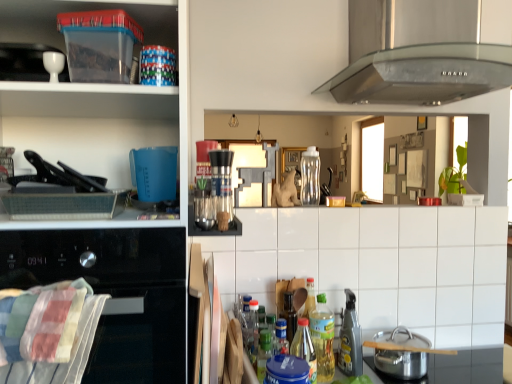
Question: Considering the relative positions of black glass oven at left, the first home appliance from the bottom, and plaid fabric towel at lower left in the image provided, is black glass oven at left, the first home appliance from the bottom, to the left of plaid fabric towel at lower left from the viewer's perspective?

Choices:
 (A) yes
 (B) no

Answer: (A)

Question: From a real-world perspective, is black glass oven at left, the first home appliance from the bottom, located higher than plaid fabric towel at lower left?

Choices:
 (A) yes
 (B) no

Answer: (B)

Question: From the image's perspective, does black glass oven at left, the first home appliance from the bottom, appear higher than plaid fabric towel at lower left?

Choices:
 (A) no
 (B) yes

Answer: (A)

Question: Is black glass oven at left, the 2th home appliance positioned from the right, oriented towards plaid fabric towel at lower left?

Choices:
 (A) no
 (B) yes

Answer: (B)

Question: Is black glass oven at left, the 2th home appliance positioned from the right, wider than plaid fabric towel at lower left?

Choices:
 (A) yes
 (B) no

Answer: (A)

Question: From a real-world perspective, does black glass oven at left, the 2th home appliance positioned from the right, sit lower than plaid fabric towel at lower left?

Choices:
 (A) yes
 (B) no

Answer: (A)

Question: Are transparent plastic container at upper left, which appears as the third shelf when viewed from the right, and translucent plastic bottle at center, which is the 3th bottle in back-to-front order, located far from each other?

Choices:
 (A) no
 (B) yes

Answer: (A)

Question: Is transparent plastic container at upper left, which ranks as the first shelf in left-to-right order, next to translucent plastic bottle at center, which is the 3th bottle in back-to-front order?

Choices:
 (A) yes
 (B) no

Answer: (B)

Question: Is transparent plastic container at upper left, which appears as the third shelf when viewed from the right, closer to camera compared to translucent plastic bottle at center, which is the 3th bottle in back-to-front order?

Choices:
 (A) no
 (B) yes

Answer: (B)

Question: From the image's perspective, is transparent plastic container at upper left, which ranks as the first shelf in left-to-right order, on translucent plastic bottle at center, which ranks as the first bottle in front-to-back order?

Choices:
 (A) yes
 (B) no

Answer: (A)

Question: Can you confirm if transparent plastic container at upper left, which ranks as the first shelf in left-to-right order, is shorter than translucent plastic bottle at center, the 3th bottle from the top?

Choices:
 (A) no
 (B) yes

Answer: (A)

Question: Does transparent plastic container at upper left, which ranks as the first shelf in left-to-right order, contain translucent plastic bottle at center, which is the 3th bottle in back-to-front order?

Choices:
 (A) yes
 (B) no

Answer: (B)

Question: Is metallic spray bottle at lower center, which is counted as the second appliance, starting from the top, not inside clear plastic bottle at center, which ranks as the 1th bottle in top-to-bottom order?

Choices:
 (A) yes
 (B) no

Answer: (A)